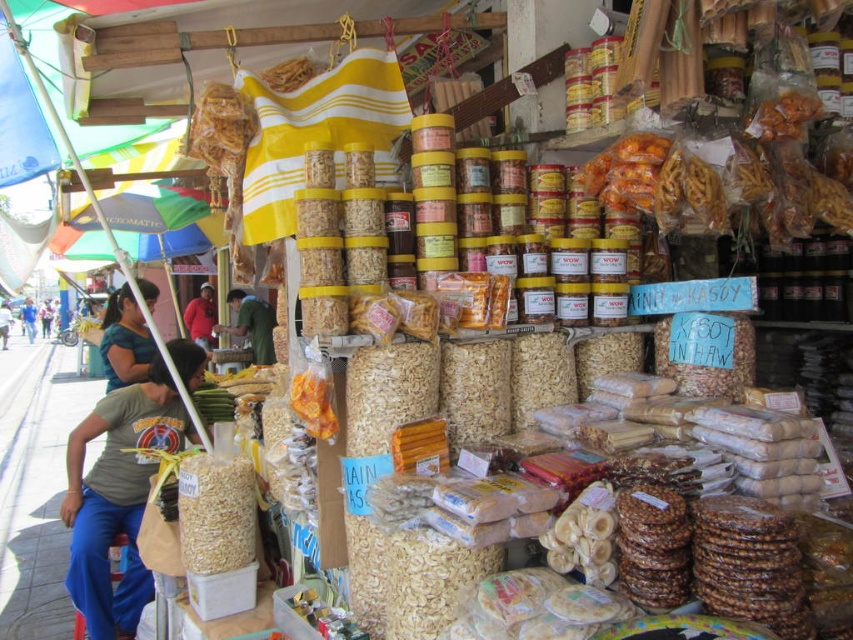
Question: Considering the real-world distances, which object is closest to the light green fabric at lower left?

Choices:
 (A) green fabric shirt at left
 (B) green fabric shirt at center
 (C) green fabric shirt at lower left

Answer: (A)

Question: Can you confirm if red cotton shirt at center is bigger than light green fabric at lower left?

Choices:
 (A) no
 (B) yes

Answer: (A)

Question: Does brown matte cereal at center have a lesser width compared to red cotton shirt at center?

Choices:
 (A) yes
 (B) no

Answer: (A)

Question: Does green cotton shirt at lower left come behind green fabric shirt at lower left?

Choices:
 (A) yes
 (B) no

Answer: (B)

Question: Estimate the real-world distances between objects in this image. Which object is closer to the green fabric shirt at center?

Choices:
 (A) brown matte cereal at center
 (B) red cotton shirt at center
 (C) green fabric shirt at left
 (D) light green fabric at lower left

Answer: (B)

Question: Among these objects, which one is nearest to the camera?

Choices:
 (A) green cotton shirt at lower left
 (B) red cotton shirt at center
 (C) green fabric shirt at center
 (D) blue-green fabric shirt at left

Answer: (A)